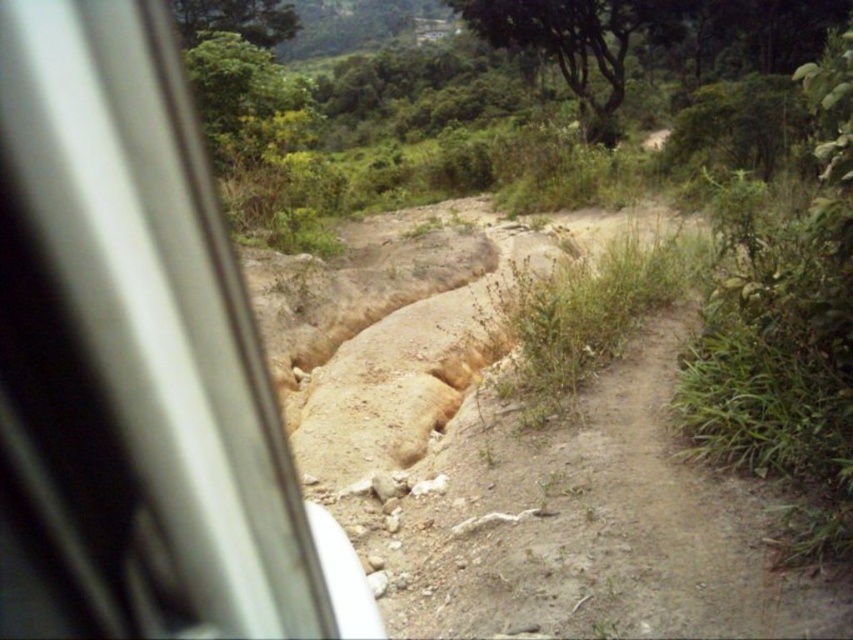
You are a drone operator planning to fly a drone between the green leafy tree at upper center and the green leafy tree at upper left. The drone has a maximum flight distance of 10 meters. Can the drone safely travel between these two trees without exceeding its range?

The green leafy tree at upper center and green leafy tree at upper left are 11.55 meters apart from each other. Since the drone has a maximum flight distance of 10 meters, it cannot safely travel between them without exceeding its range.

You are a passenger in the car and looking out the window. You see two points marked on the window. The first point is at coordinates point (144, 8) and the second is at point (619, 28). Which point is closer to your eyes?

Point (144, 8) is closer to the viewer than point (619, 28).

You are a passenger sitting in the vehicle and looking out through the window. There is a point marked at coordinates (131, 355). Based on the scene description, where is this point located?

The point is located on the metallic silver train window at left.